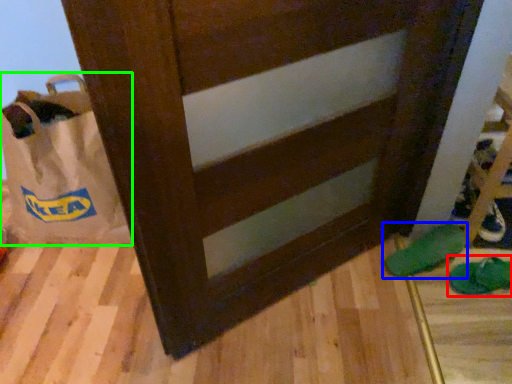
Question: Which is farther away from footwear (highlighted by a red box)? footwear (highlighted by a blue box) or grocery bag (highlighted by a green box)?

Choices:
 (A) footwear
 (B) grocery bag

Answer: (B)